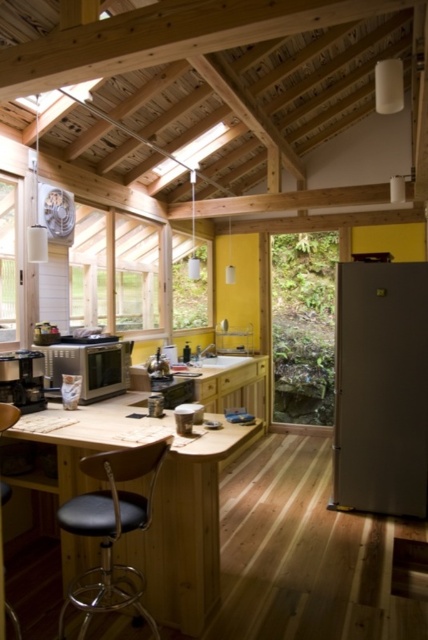
You are a delivery person who needs to place a new 36 inch wide package between the black leather bar stool at center and the black matte coffee maker at lower left. Can you fit the package in that space?

The black leather bar stool at center and the black matte coffee maker at lower left are 34.43 inches apart from each other. Since the package is 36 inches wide, it cannot fit in the space between them as the distance is smaller than the package width.

You are a delivery person who just arrived at the kitchen. You need to place a new black leather bar stool at center. Where exactly should you place it?

You should place the black leather bar stool at center at point (110, 531).

You are a delivery person trying to bring a new coffee maker that is 15 cm wide into the kitchen. The current black matte coffee maker at lower left is in the way. Can you move the black leather bar stool at center to make space for the new coffee maker?

The black leather bar stool at center might be wider than the black matte coffee maker at lower left. If the stool is indeed wider, moving it could create enough space for the new coffee maker. However, if they are similar in width, it might not help. You need to check the actual dimensions to be sure.